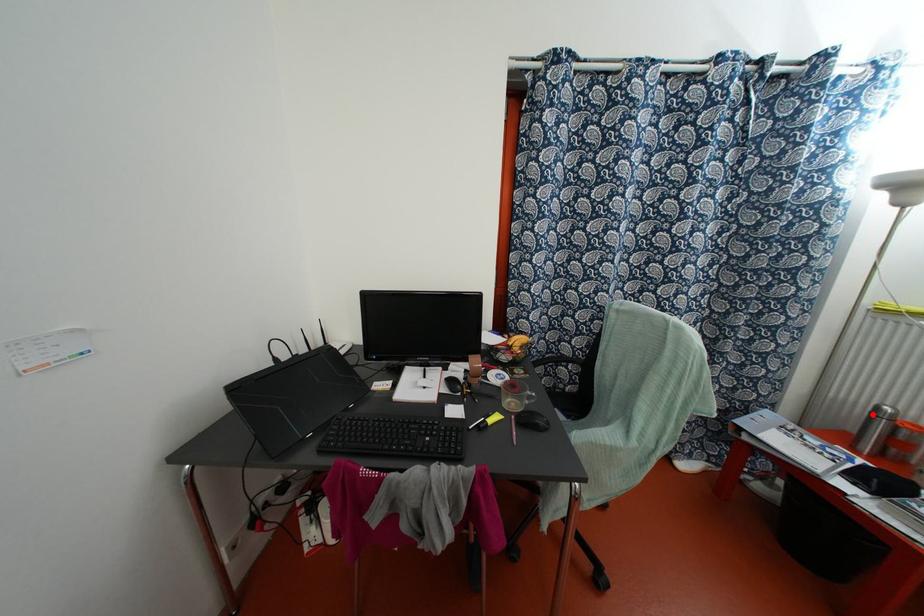
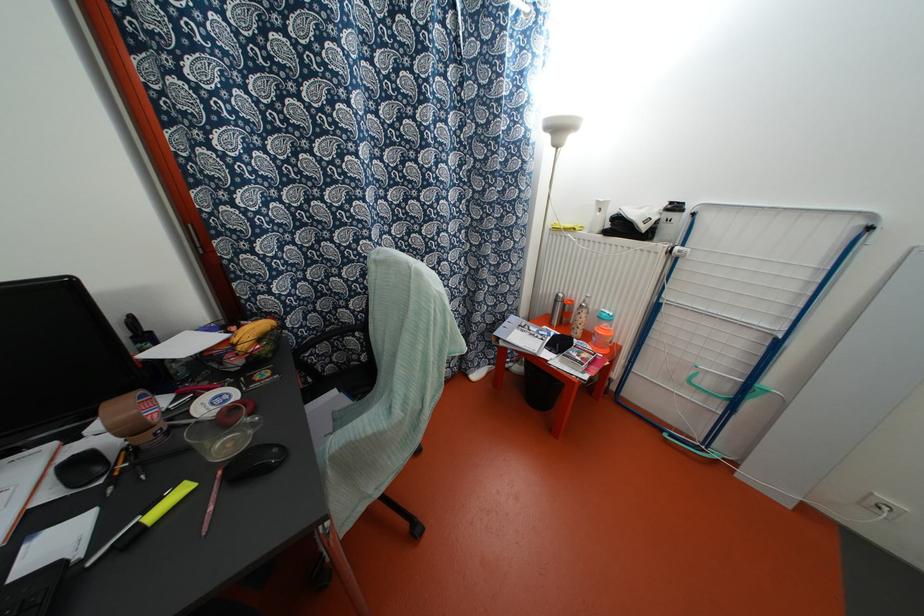
Question: I am providing you with two images of the same scene from different viewpoints. In image1, a red point is highlighted. Considering the same 3D point in image2, which of the following is correct?

Choices:
 (A) It is closer
 (B) It is farther

Answer: (A)